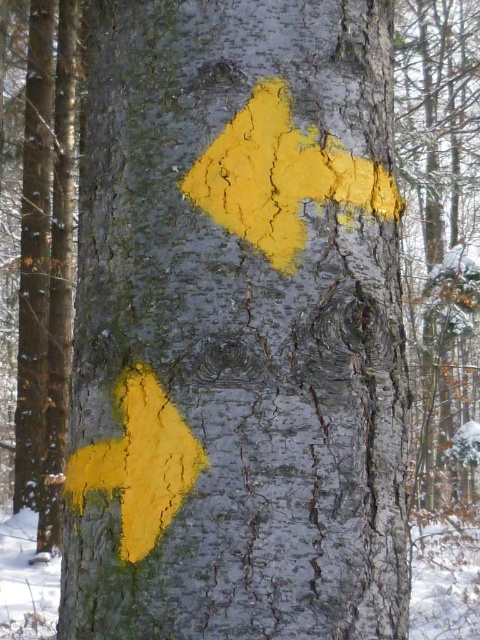
Question: Does yellow matte arrow at center appear on the right side of yellow matte arrow at lower left?

Choices:
 (A) yes
 (B) no

Answer: (A)

Question: Among these objects, which one is nearest to the camera?

Choices:
 (A) yellow matte arrow at center
 (B) yellow matte arrow at lower left

Answer: (B)

Question: Is yellow matte arrow at center below yellow matte arrow at lower left?

Choices:
 (A) yes
 (B) no

Answer: (B)

Question: Is yellow matte arrow at center closer to camera compared to yellow matte arrow at lower left?

Choices:
 (A) no
 (B) yes

Answer: (A)